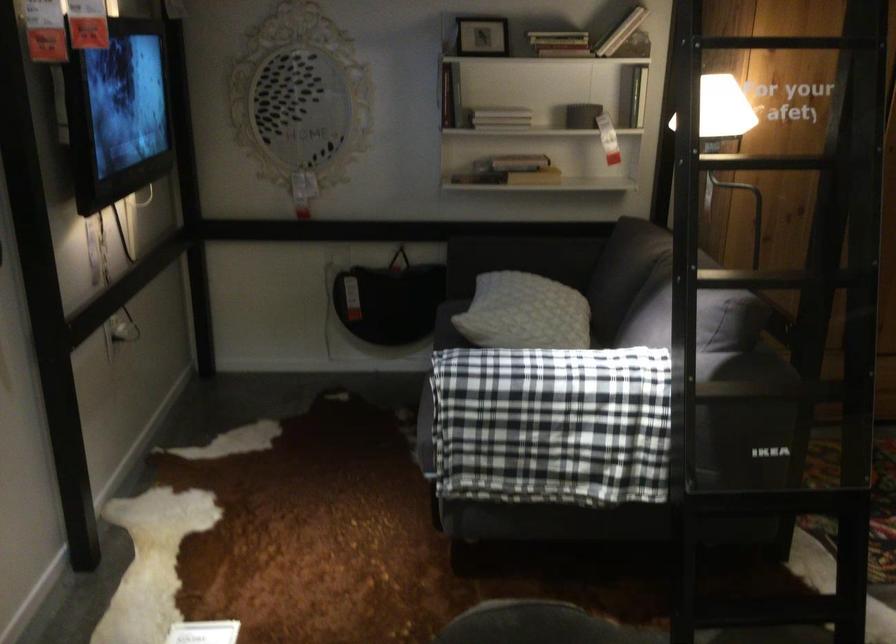
Where is `sofa armrest`? This screenshot has width=896, height=644. sofa armrest is located at coordinates (745, 366).